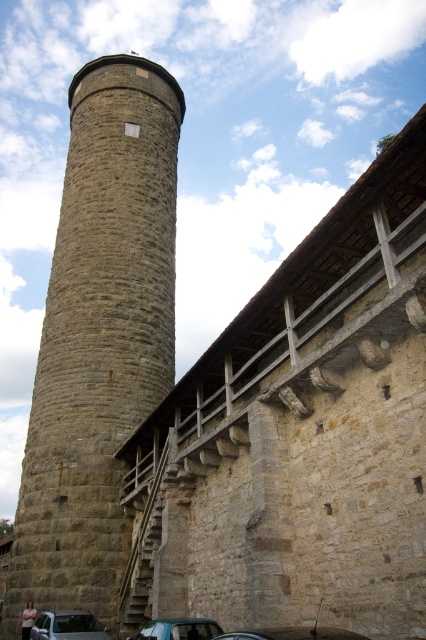
You are driving a metallic blue car at lower center and want to park it near the stone water tower at center. Which direction should you move your car to get closer to the tower?

The stone water tower at center is to the left of the metallic blue car at lower center, so you should move your car to the left to get closer to the tower.

You are driving a car and want to park in the parking lot shown in the image. There are two cars already parked there, a metallic silver car at lower left and a metallic blue car at lower center. Which car is closer to the entrance of the parking lot?

The metallic silver car at lower left is closer to the entrance of the parking lot since it is positioned to the left of the metallic blue car at lower center, and typically parking entrances are on the left side.